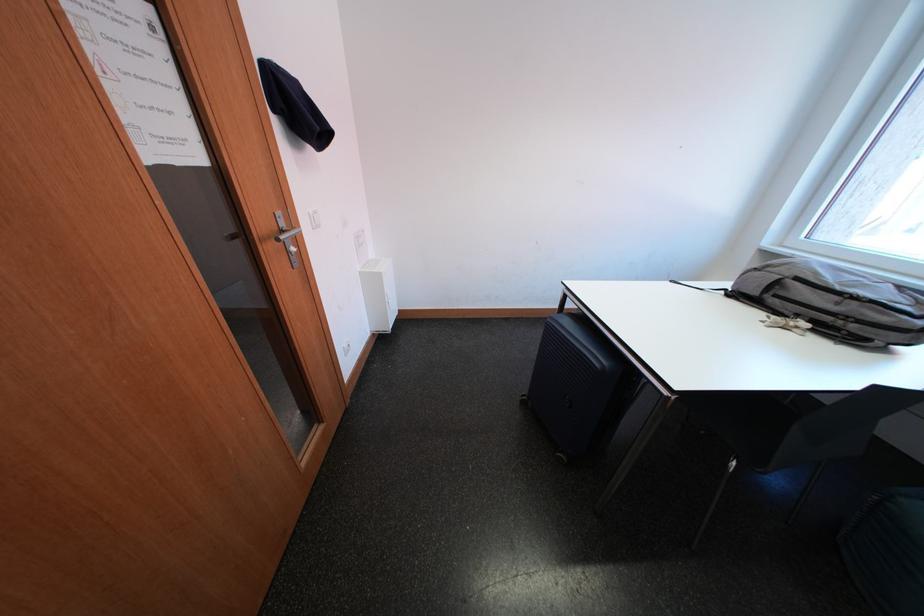
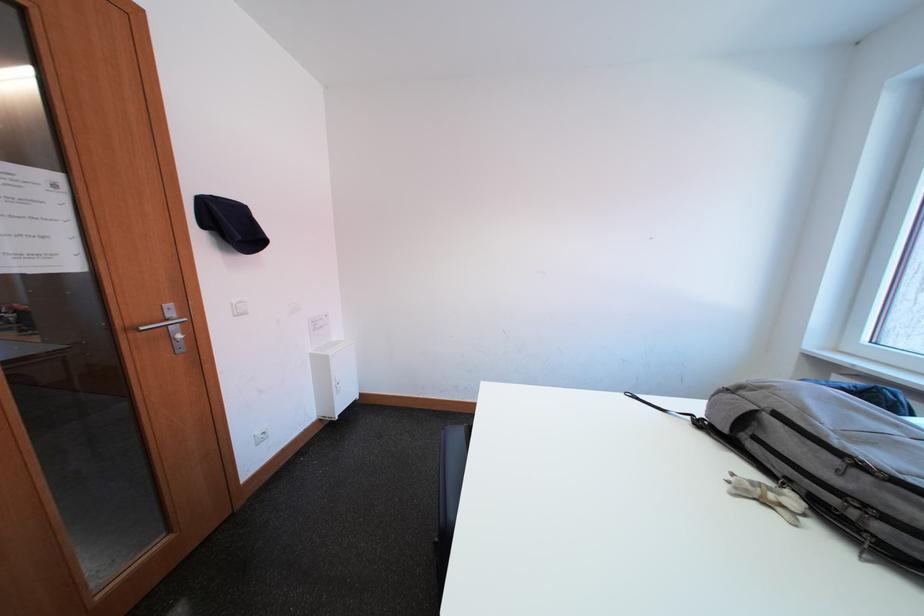
In the second image, find the point that corresponds to pixel 293 227 in the first image.

(180, 317)